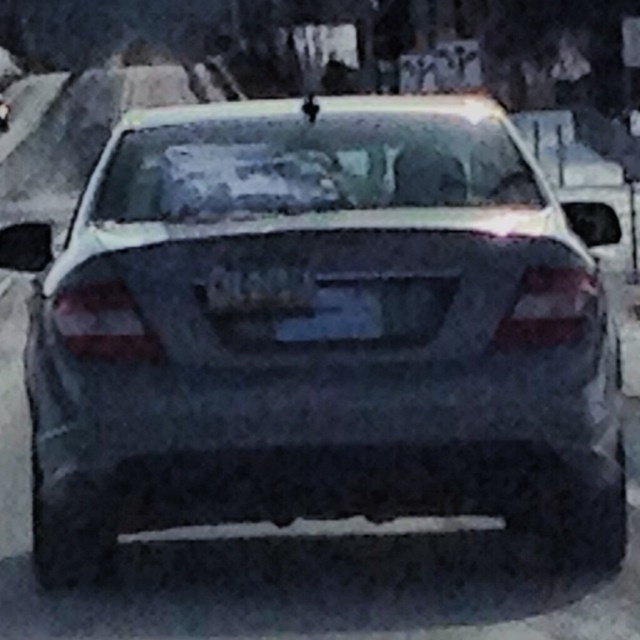
In the scene shown: Does black plastic license plate at center have a greater width compared to satin black sedan at center?

In fact, black plastic license plate at center might be narrower than satin black sedan at center.

Looking at this image, does black plastic license plate at center lie behind satin black sedan at center?

No, black plastic license plate at center is closer to the viewer.

Which is in front, point (212, 278) or point (1, 106)?

Point (212, 278) is more forward.

This screenshot has width=640, height=640. In order to click on black plastic license plate at center in this screenshot , I will do `click(257, 289)`.